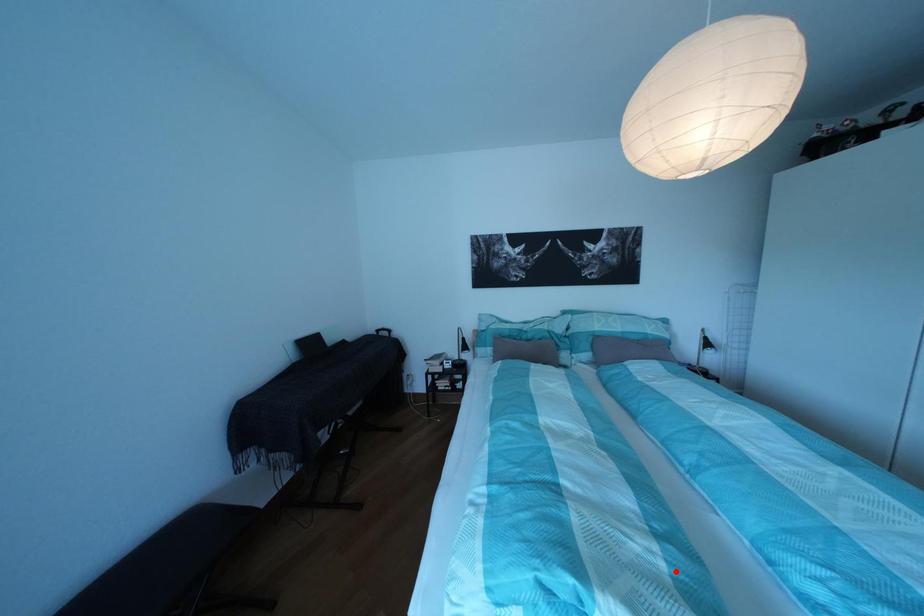
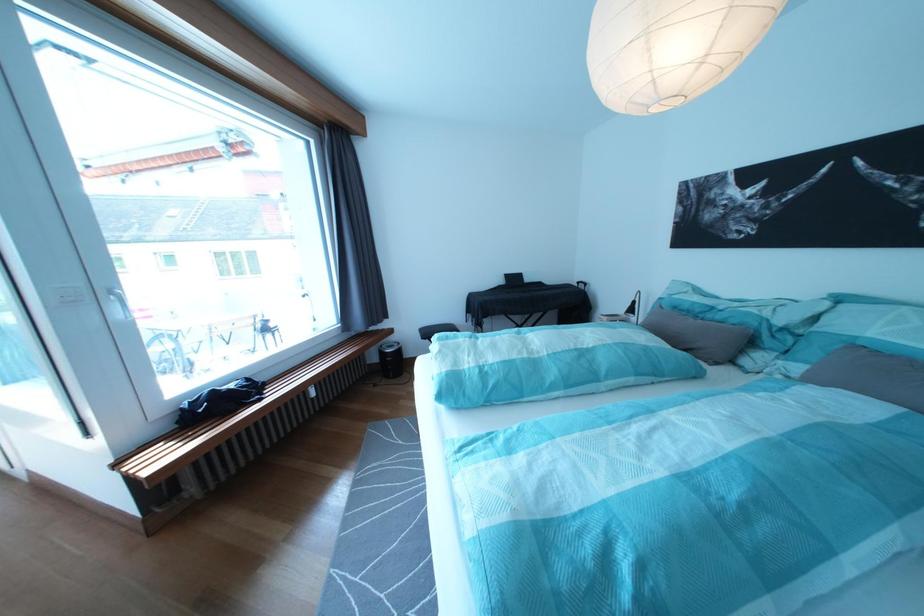
Locate, in the second image, the point that corresponds to the highlighted location in the first image.

(480, 373)